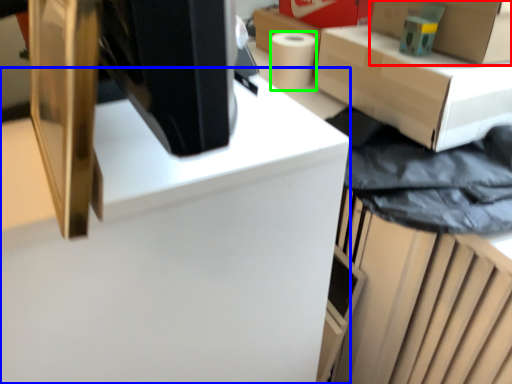
Question: Based on their relative distances, which object is farther from box (highlighted by a red box)? Choose from computer desk (highlighted by a blue box) and paper towel (highlighted by a green box).

Choices:
 (A) computer desk
 (B) paper towel

Answer: (A)